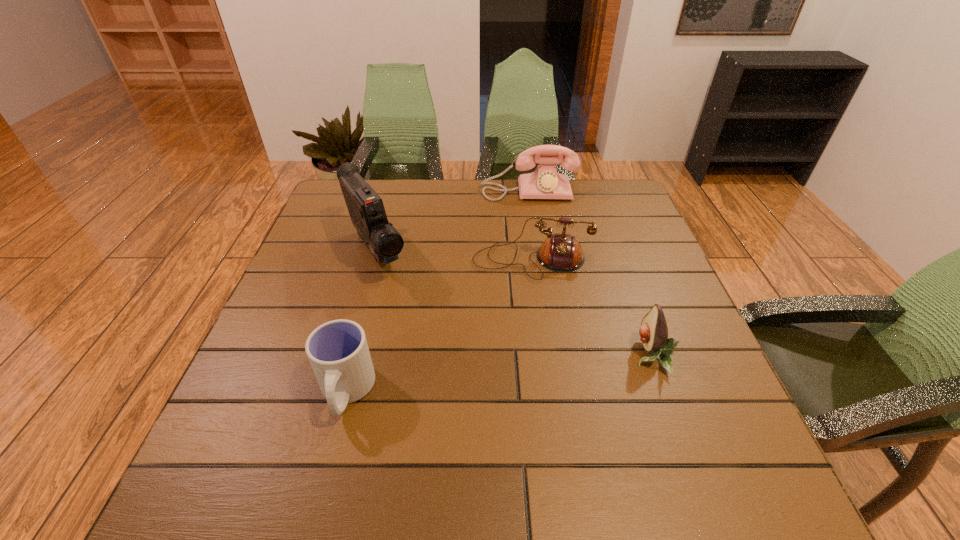
The image size is (960, 540). In order to click on vacant space on the desktop that is between the cup and the avocado and is positioned on the dial of the farthest object in this screenshot , I will do `click(547, 368)`.

Locate an element on the screen. This screenshot has width=960, height=540. free space on the desktop that is between the cup and the rightmost object and is positioned on the front-facing side of the tallest object is located at coordinates (465, 378).

At what (x,y) coordinates should I click in order to perform the action: click on vacant space on the desktop that is between the cup and the rightmost object and is positioned on the rotary dial of the shorter telephone. Please return your answer as a coordinate pair (x, y). Image resolution: width=960 pixels, height=540 pixels. Looking at the image, I should click on (519, 372).